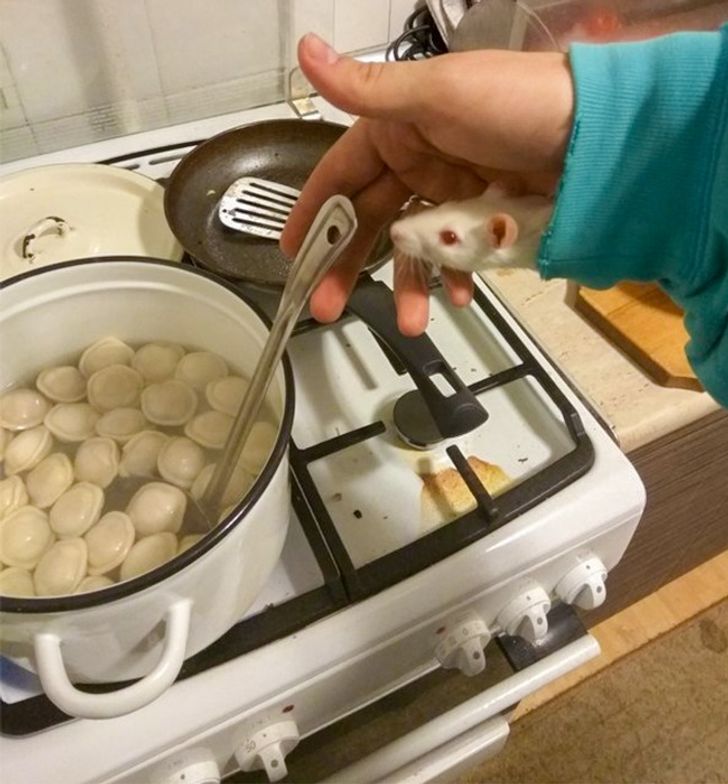
Identify the location of handle for oven door. The height and width of the screenshot is (784, 728). (485, 701).